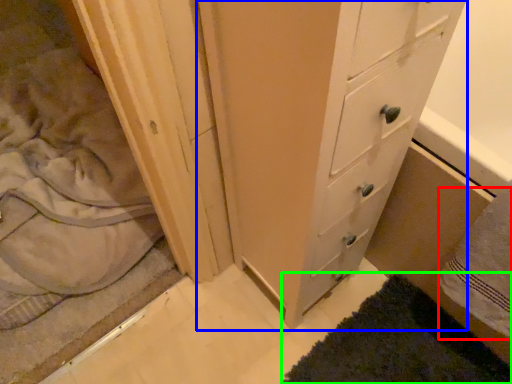
Question: Estimate the real-world distances between objects in this image. Which object is closer to bath towel (highlighted by a red box), chest of drawers (highlighted by a blue box) or bath mat (highlighted by a green box)?

Choices:
 (A) chest of drawers
 (B) bath mat

Answer: (B)